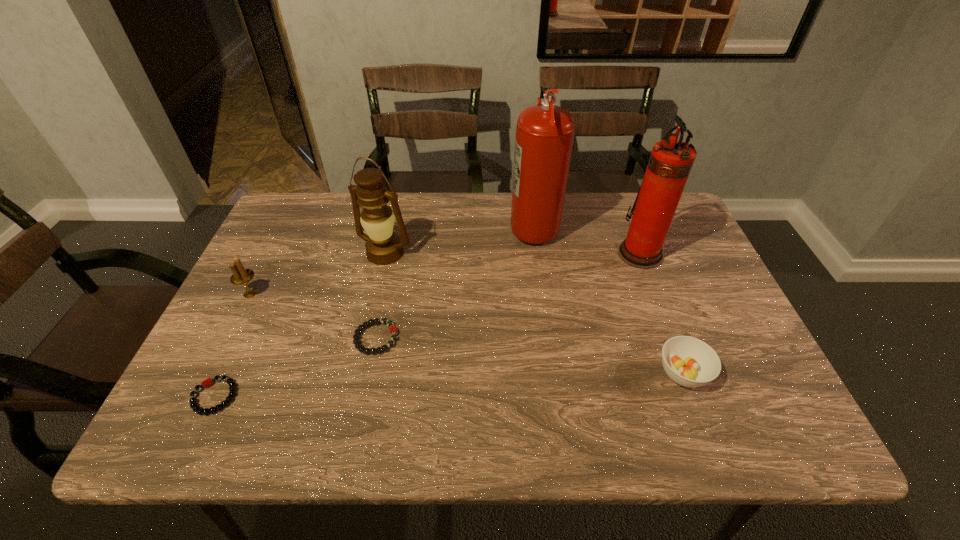
This screenshot has width=960, height=540. What are the coordinates of `vacant area at the left edge of the desktop` in the screenshot? It's located at (313, 266).

Find the location of a particular element. free spot at the right edge of the desktop is located at coordinates (724, 327).

The width and height of the screenshot is (960, 540). In order to click on free location at the far right corner of the desktop in this screenshot , I will do `click(678, 210)`.

You are a GUI agent. You are given a task and a screenshot of the screen. Output one action in this format:
    pyautogui.click(x=<x>, y=<y>)
    Task: Click on the free location at the near right corner
    The height and width of the screenshot is (540, 960).
    Given the screenshot: What is the action you would take?
    pyautogui.click(x=711, y=409)

Where is `free point between the right fire extinguisher and the right bracelet`? free point between the right fire extinguisher and the right bracelet is located at coordinates (508, 296).

You are a GUI agent. You are given a task and a screenshot of the screen. Output one action in this format:
    pyautogui.click(x=<x>, y=<y>)
    Task: Click on the vacant point located between the third shortest object and the second tallest object
    
    Given the screenshot: What is the action you would take?
    pyautogui.click(x=661, y=313)

Find the location of a particular element. vacant area that lies between the fourth shortest object and the oil lamp is located at coordinates click(318, 273).

You are a GUI agent. You are given a task and a screenshot of the screen. Output one action in this format:
    pyautogui.click(x=<x>, y=<y>)
    Task: Click on the empty space between the third object from right to left and the third tallest object
    The image size is (960, 540).
    Given the screenshot: What is the action you would take?
    pyautogui.click(x=459, y=239)

Where is `free point between the left bracelet and the sixth shortest object`? This screenshot has width=960, height=540. free point between the left bracelet and the sixth shortest object is located at coordinates (427, 325).

The width and height of the screenshot is (960, 540). Find the location of `free space between the farther bracelet and the right fire extinguisher`. free space between the farther bracelet and the right fire extinguisher is located at coordinates (508, 296).